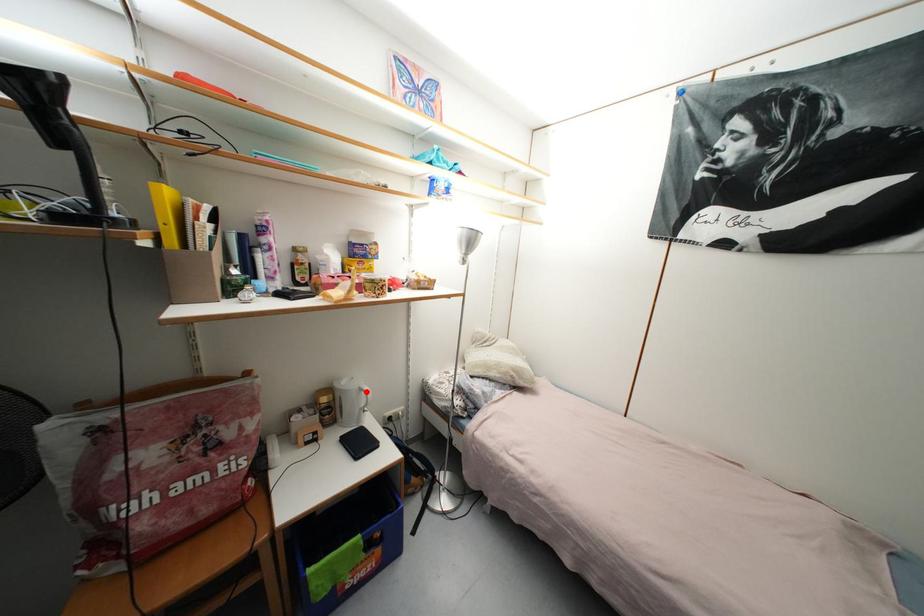
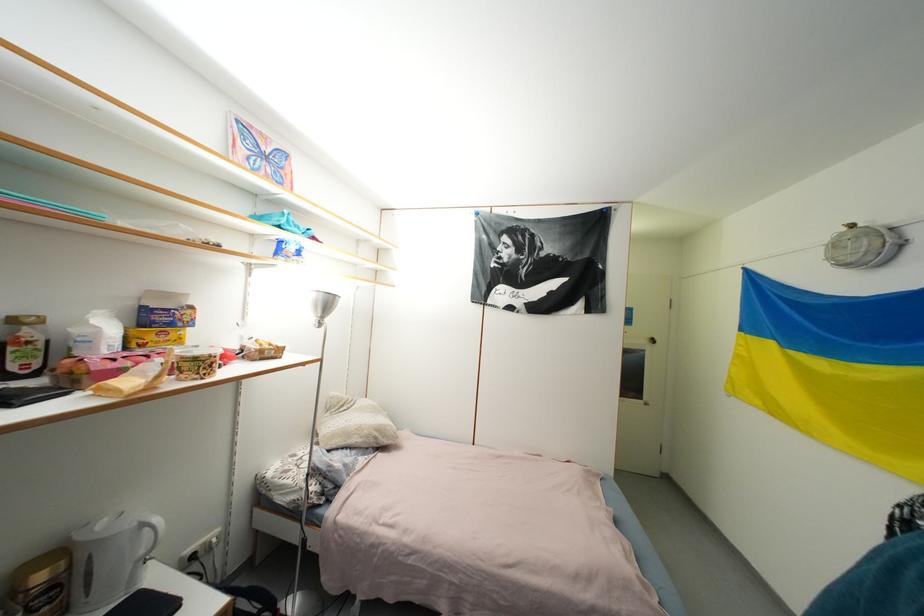
The point at the highlighted location is marked in the first image. Where is the corresponding point in the second image?

(149, 528)